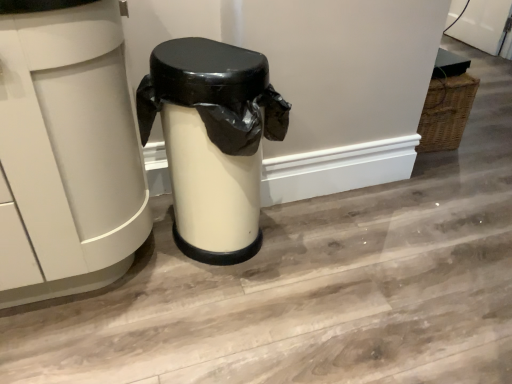
Question: Does matte white trash can at center, the 1th waste container from the right, have a lesser height compared to white matte trash can at center, acting as the 2th waste container starting from the right?

Choices:
 (A) yes
 (B) no

Answer: (A)

Question: Considering the relative sizes of matte white trash can at center, the 1th waste container from the right, and white matte trash can at center, which appears as the first waste container when viewed from the left, in the image provided, is matte white trash can at center, the 1th waste container from the right, bigger than white matte trash can at center, which appears as the first waste container when viewed from the left,?

Choices:
 (A) no
 (B) yes

Answer: (A)

Question: Could you tell me if matte white trash can at center, the 1th waste container from the right, is facing white matte trash can at center, acting as the 2th waste container starting from the right?

Choices:
 (A) yes
 (B) no

Answer: (B)

Question: Is matte white trash can at center, the 2th waste container when ordered from left to right, in contact with white matte trash can at center, acting as the 2th waste container starting from the right?

Choices:
 (A) no
 (B) yes

Answer: (A)

Question: From a real-world perspective, does matte white trash can at center, the 1th waste container from the right, stand above white matte trash can at center, which appears as the first waste container when viewed from the left?

Choices:
 (A) no
 (B) yes

Answer: (A)

Question: Considering the relative positions of matte white trash can at center, the 2th waste container when ordered from left to right, and white matte trash can at center, acting as the 2th waste container starting from the right, in the image provided, is matte white trash can at center, the 2th waste container when ordered from left to right, to the right of white matte trash can at center, acting as the 2th waste container starting from the right, from the viewer's perspective?

Choices:
 (A) yes
 (B) no

Answer: (A)

Question: Is matte white trash can at center, the 1th waste container from the right, completely or partially inside white matte trash can at center, which appears as the first waste container when viewed from the left?

Choices:
 (A) yes
 (B) no

Answer: (B)

Question: Does white matte trash can at center, which appears as the first waste container when viewed from the left, appear on the left side of matte white trash can at center, the 2th waste container when ordered from left to right?

Choices:
 (A) no
 (B) yes

Answer: (B)

Question: Can you see white matte trash can at center, which appears as the first waste container when viewed from the left, touching matte white trash can at center, the 1th waste container from the right?

Choices:
 (A) no
 (B) yes

Answer: (A)

Question: From a real-world perspective, does white matte trash can at center, which appears as the first waste container when viewed from the left, sit lower than matte white trash can at center, the 2th waste container when ordered from left to right?

Choices:
 (A) yes
 (B) no

Answer: (B)

Question: From a real-world perspective, is white matte trash can at center, which appears as the first waste container when viewed from the left, on top of matte white trash can at center, the 2th waste container when ordered from left to right?

Choices:
 (A) yes
 (B) no

Answer: (A)

Question: From the image's perspective, is white matte trash can at center, acting as the 2th waste container starting from the right, located beneath matte white trash can at center, the 1th waste container from the right?

Choices:
 (A) yes
 (B) no

Answer: (B)

Question: Visually, is white matte trash can at center, acting as the 2th waste container starting from the right, positioned to the left or to the right of matte white trash can at center, the 2th waste container when ordered from left to right?

Choices:
 (A) left
 (B) right

Answer: (A)